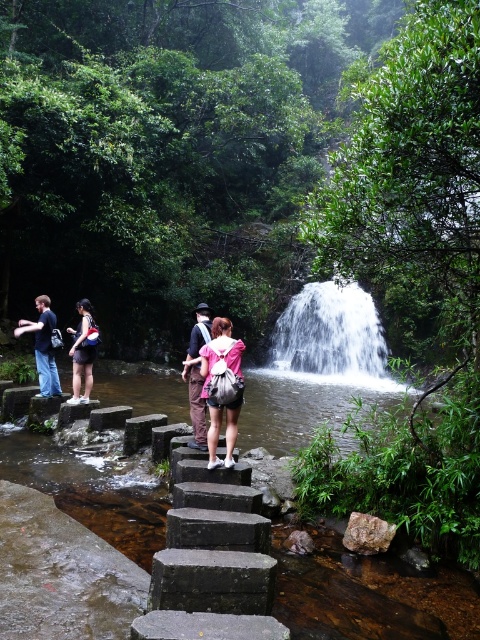
In the scene shown: Does pink fabric backpack at center appear under matte pink backpack at center?

Yes, pink fabric backpack at center is below matte pink backpack at center.

Who is shorter, pink fabric backpack at center or matte pink backpack at center?

matte pink backpack at center

The image size is (480, 640). Identify the location of pink fabric backpack at center. (208, 381).

Find the location of a particular element. The height and width of the screenshot is (640, 480). pink fabric backpack at center is located at coordinates [x=208, y=381].

What do you see at coordinates (331, 333) in the screenshot? The height and width of the screenshot is (640, 480). I see `white frothy water at center` at bounding box center [331, 333].

Measure the distance between point (364, 340) and camera.

Point (364, 340) is 22.09 meters away from camera.

Identify the location of white frothy water at center. (331, 333).

Between dark gray stone steps at center and dark blue jeans at left, which one appears on the left side from the viewer's perspective?

dark blue jeans at left

Measure the distance between dark gray stone steps at center and dark blue jeans at left.

dark gray stone steps at center and dark blue jeans at left are 6.38 meters apart.

What do you see at coordinates (213, 563) in the screenshot? Image resolution: width=480 pixels, height=640 pixels. I see `dark gray stone steps at center` at bounding box center [213, 563].

Locate an element on the screen. This screenshot has height=640, width=480. dark gray stone steps at center is located at coordinates (213, 563).